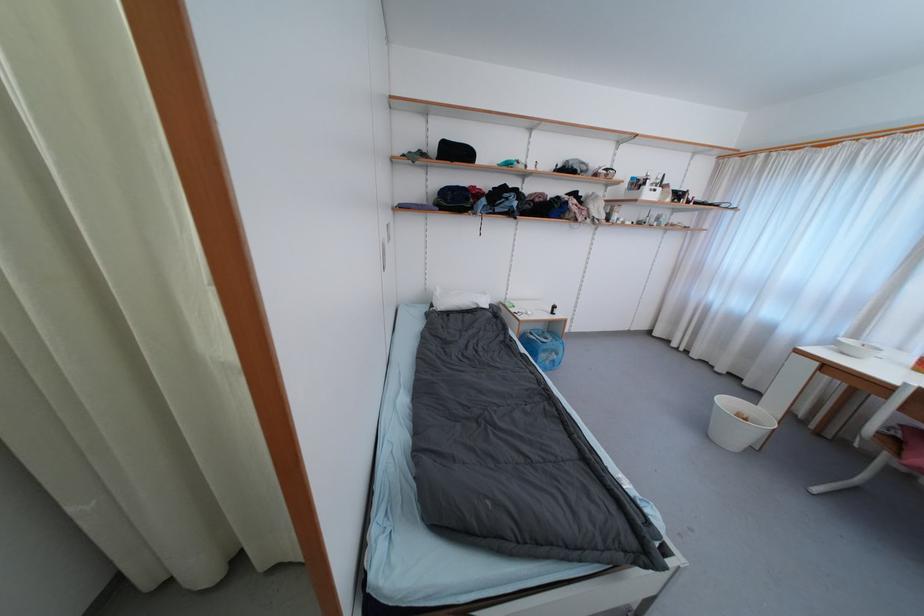
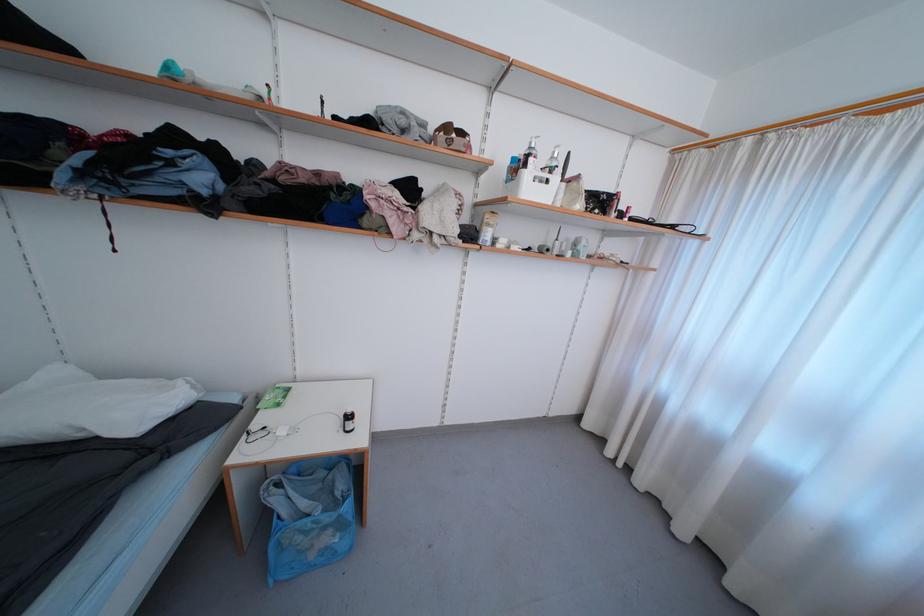
Where in the second image is the point corresponding to (673,201) from the first image?

(584, 208)